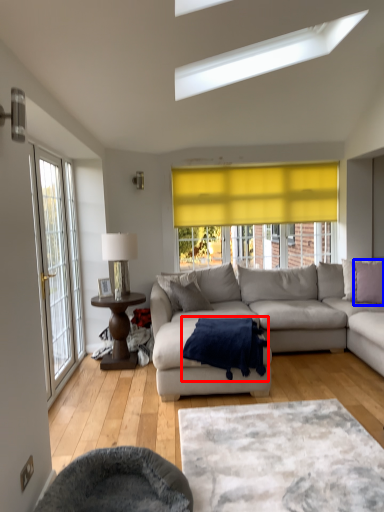
Question: Which object appears closest to the camera in this image, blanket (highlighted by a red box) or pillow (highlighted by a blue box)?

Choices:
 (A) blanket
 (B) pillow

Answer: (A)